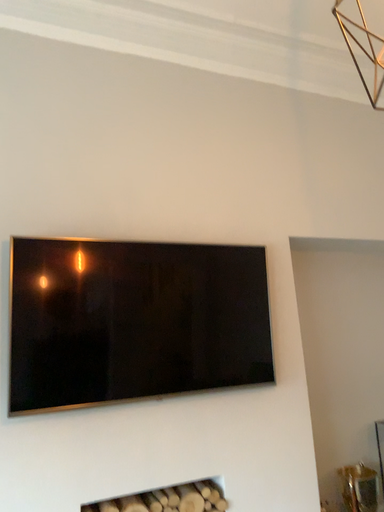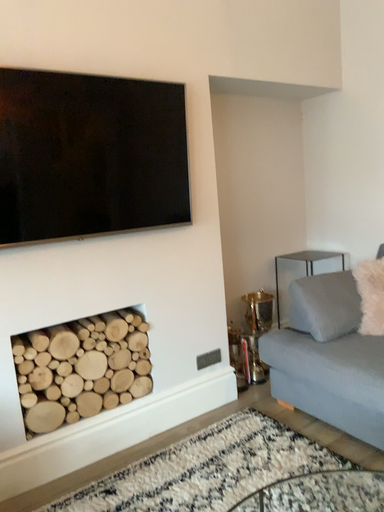
Question: How did the camera likely rotate when shooting the video?

Choices:
 (A) rotated upward
 (B) rotated downward

Answer: (B)